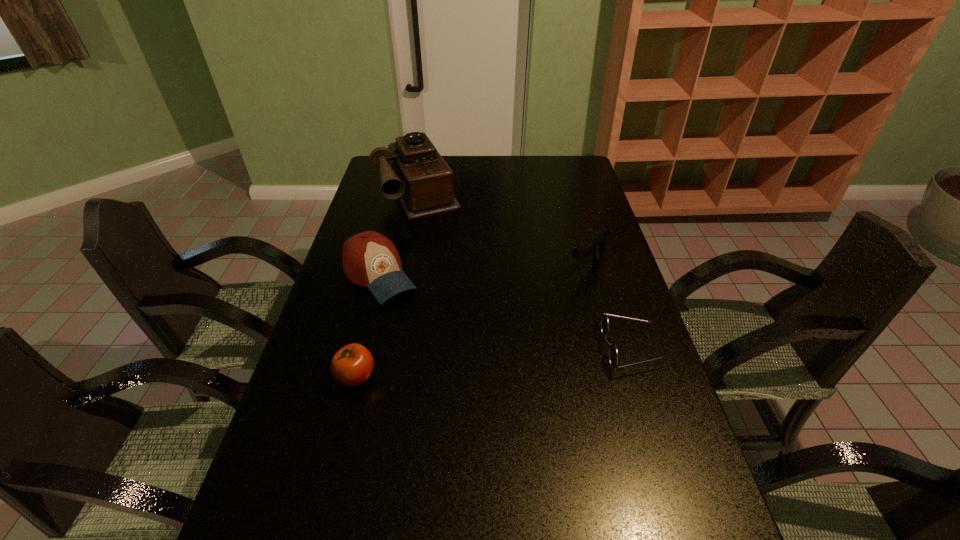
Locate an element on the screen. free region that satisfies the following two spatial constraints: 1. on the back side of the apple; 2. on the front-facing side of the shortest object is located at coordinates click(364, 349).

The height and width of the screenshot is (540, 960). What are the coordinates of `vacant space that satisfies the following two spatial constraints: 1. on the front side of the phonograph_record; 2. on the front-facing side of the spectacles` in the screenshot? It's located at (388, 349).